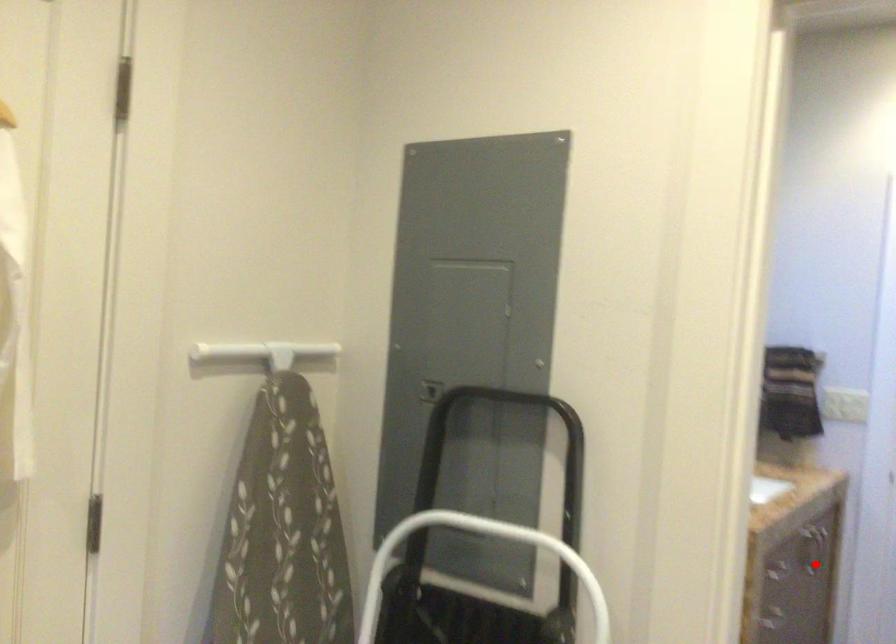
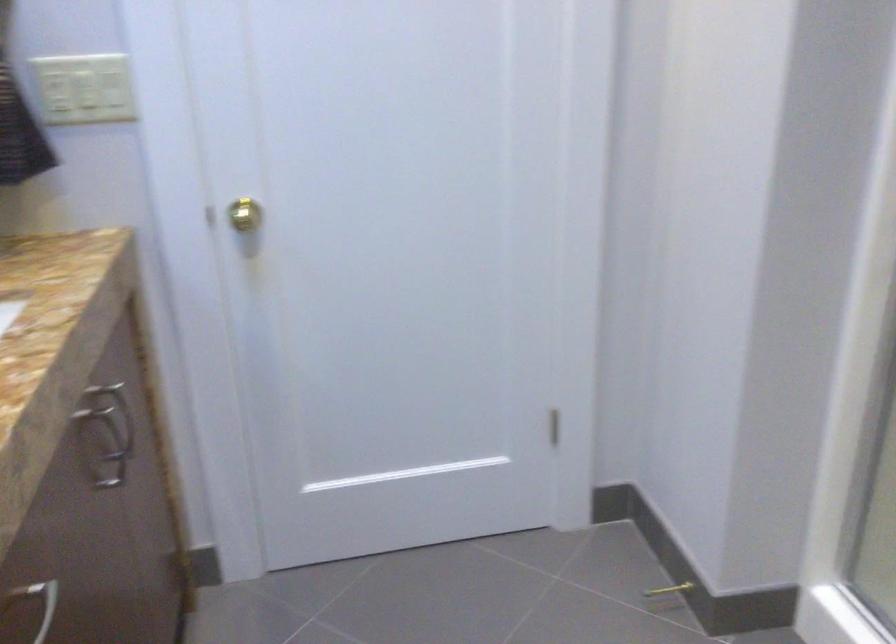
In the second image, find the point that corresponds to the highlighted location in the first image.

(113, 453)